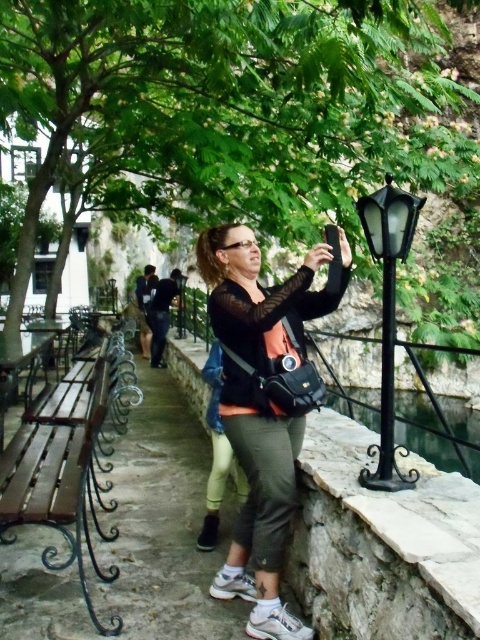
Question: Which point is closer to the camera?

Choices:
 (A) green fabric pants at center
 (B) wooden bench at left
 (C) matte black camera at center
 (D) green leafy tree at upper center

Answer: (B)

Question: Is green leafy tree at upper center smaller than green fabric pants at center?

Choices:
 (A) no
 (B) yes

Answer: (A)

Question: Which object appears closest to the camera in this image?

Choices:
 (A) matte black camera at center
 (B) wooden bench at left
 (C) green leafy tree at upper center

Answer: (B)

Question: Does wooden bench at left have a larger size compared to black wrought iron lamp post at right?

Choices:
 (A) no
 (B) yes

Answer: (B)

Question: Does matte black camera at center lie behind black wrought iron lamp post at right?

Choices:
 (A) yes
 (B) no

Answer: (B)

Question: Which of the following is the closest to the observer?

Choices:
 (A) (457, 157)
 (B) (90, 404)

Answer: (B)